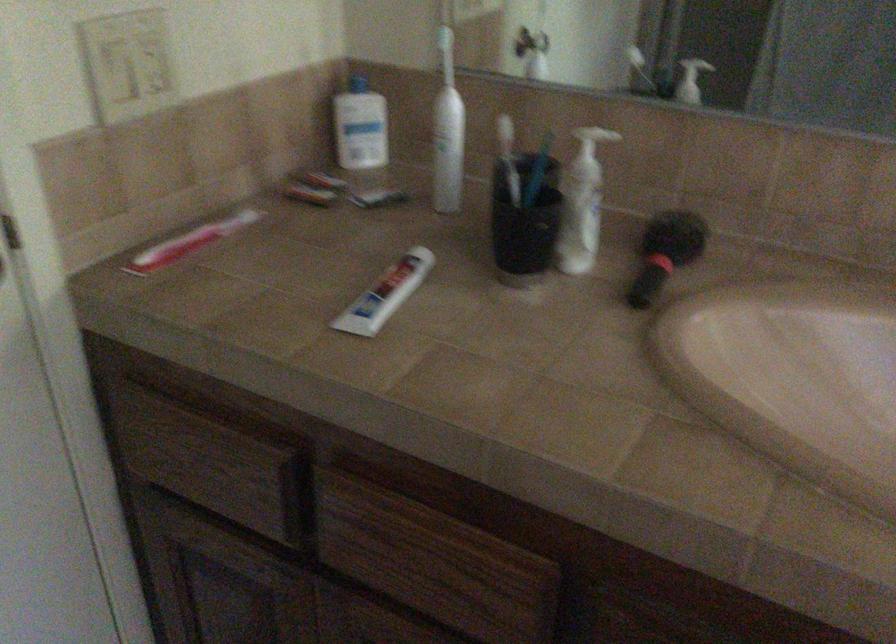
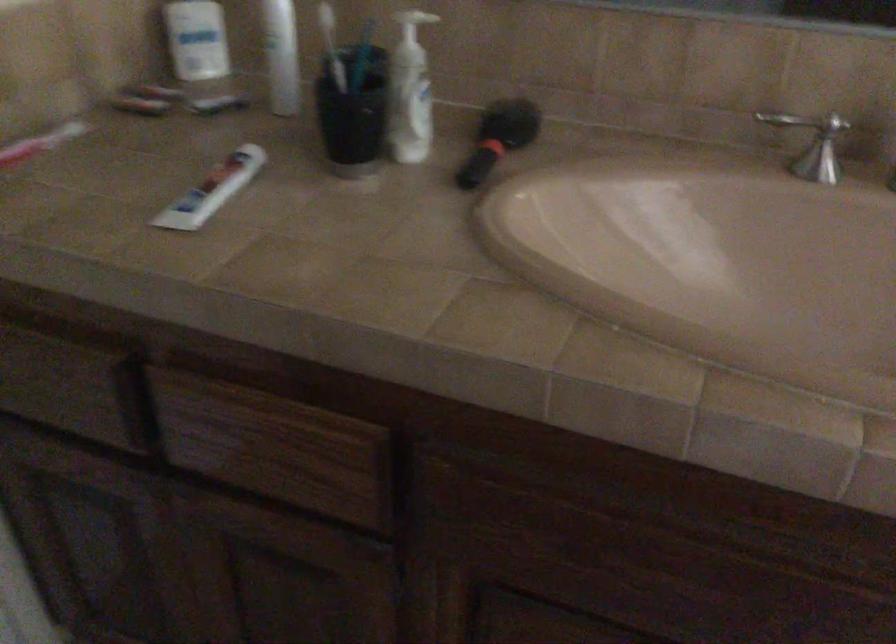
In the second image, find the point that corresponds to pixel 531 225 in the first image.

(352, 113)